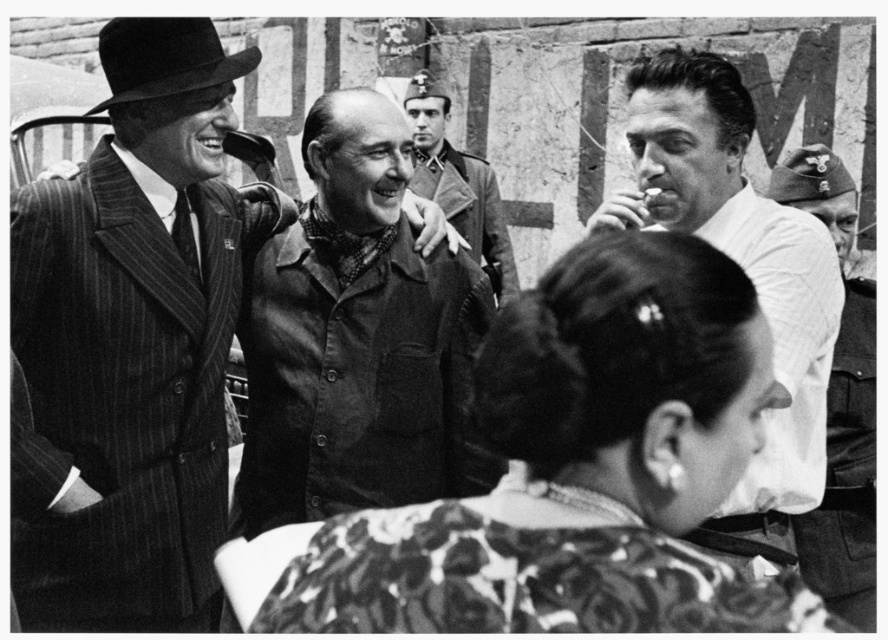
Is point (18, 544) more distant than point (858, 608)?

No, it is in front of (858, 608).

Does point (186, 396) lie in front of point (865, 419)?

No, (186, 396) is further to viewer.

This screenshot has height=640, width=888. I want to click on striped wool suit at center, so click(x=131, y=342).

Between floral-patterned blouse at center and smooth leather jacket at center, which one has more height?

smooth leather jacket at center is taller.

Between floral-patterned blouse at center and smooth leather jacket at center, which one appears on the left side from the viewer's perspective?

smooth leather jacket at center

Is point (613, 360) behind point (511, 276)?

No, (613, 360) is closer to viewer.

Where is `floral-patterned blouse at center`? The width and height of the screenshot is (888, 640). floral-patterned blouse at center is located at coordinates (579, 467).

Can you confirm if white matte shirt at upper right is smaller than smooth leather jacket at center?

Incorrect, white matte shirt at upper right is not smaller in size than smooth leather jacket at center.

Is white matte shirt at upper right to the right of smooth leather jacket at center from the viewer's perspective?

Indeed, white matte shirt at upper right is positioned on the right side of smooth leather jacket at center.

Where is `white matte shirt at upper right`? The image size is (888, 640). white matte shirt at upper right is located at coordinates (746, 273).